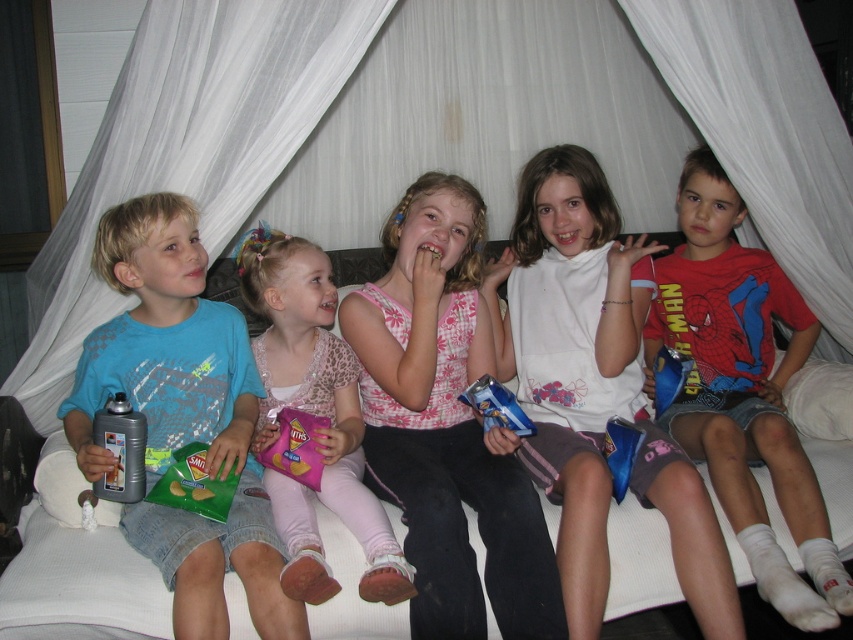
Question: Is matte white shirt at center bigger than pink floral shirt at center?

Choices:
 (A) yes
 (B) no

Answer: (A)

Question: Which object appears closest to the camera in this image?

Choices:
 (A) pink floral tank top at center
 (B) matte blue t-shirt at left

Answer: (B)

Question: Which point appears closest to the camera in this image?

Choices:
 (A) (183, 220)
 (B) (409, 576)

Answer: (B)

Question: Is pink floral shirt at center wider than metallic silver soda can at left?

Choices:
 (A) yes
 (B) no

Answer: (A)

Question: Does pink floral tank top at center have a greater width compared to metallic silver soda can at left?

Choices:
 (A) yes
 (B) no

Answer: (A)

Question: Among these points, which one is nearest to the camera?

Choices:
 (A) (x=387, y=278)
 (B) (x=804, y=520)
 (C) (x=289, y=493)
 (D) (x=112, y=442)

Answer: (D)